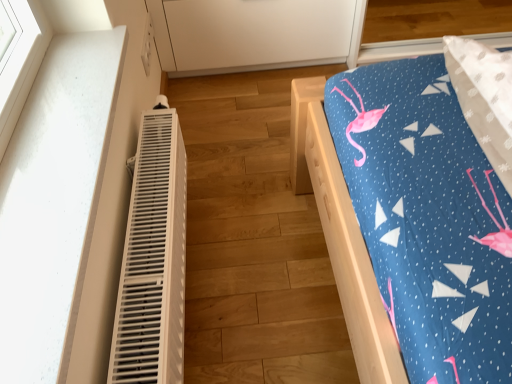
Identify the location of vacant space situated above wooden bed at right (from a real-world perspective). The width and height of the screenshot is (512, 384). (246, 190).